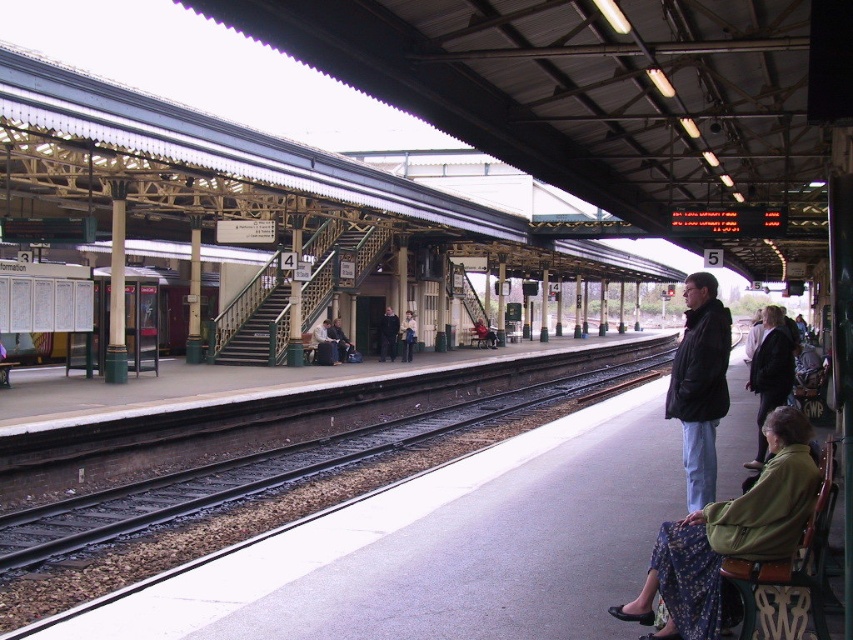
Question: Can you confirm if dark gray metal train track at center is positioned below matte black jacket at center?

Choices:
 (A) yes
 (B) no

Answer: (A)

Question: Which point is closer to the camera taking this photo?

Choices:
 (A) (381, 356)
 (B) (343, 333)
 (C) (483, 333)
 (D) (764, 355)

Answer: (D)

Question: Which object appears closest to the camera in this image?

Choices:
 (A) matte black jacket at center
 (B) dark blue jacket at center
 (C) dark gray jacket at lower right

Answer: (C)

Question: Is black matte jacket at lower right to the left of matte black jacket at center from the viewer's perspective?

Choices:
 (A) yes
 (B) no

Answer: (B)

Question: Among these objects, which one is farthest from the camera?

Choices:
 (A) dark gray metal train track at center
 (B) metallic red train at left
 (C) dark gray suit at center
 (D) matte black jacket at center

Answer: (D)

Question: Does dark gray metal train track at center appear on the left side of dark gray suit at center?

Choices:
 (A) yes
 (B) no

Answer: (B)